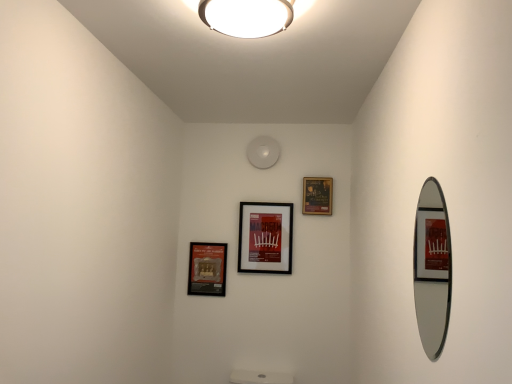
Question: Does white glossy ceiling light at upper center have a lesser width compared to matte black picture frame at center, placed as the second picture frame when sorted from right to left?

Choices:
 (A) no
 (B) yes

Answer: (A)

Question: Is white glossy ceiling light at upper center further to camera compared to matte black picture frame at center, the 2th picture frame viewed from the left?

Choices:
 (A) no
 (B) yes

Answer: (A)

Question: Is the position of white glossy ceiling light at upper center less distant than that of matte black picture frame at center, placed as the second picture frame when sorted from right to left?

Choices:
 (A) yes
 (B) no

Answer: (A)

Question: Does white glossy ceiling light at upper center have a lesser height compared to matte black picture frame at center, placed as the second picture frame when sorted from right to left?

Choices:
 (A) no
 (B) yes

Answer: (B)

Question: Is white glossy ceiling light at upper center turned away from matte black picture frame at center, placed as the second picture frame when sorted from right to left?

Choices:
 (A) no
 (B) yes

Answer: (A)

Question: From the image's perspective, relative to matte black picture frame at upper center, which ranks as the 3th picture frame in left-to-right order, is white glossy ceiling light at upper center above or below?

Choices:
 (A) below
 (B) above

Answer: (B)

Question: From a real-world perspective, is white glossy ceiling light at upper center above or below matte black picture frame at upper center, which ranks as the 3th picture frame in left-to-right order?

Choices:
 (A) above
 (B) below

Answer: (A)

Question: In terms of height, does white glossy ceiling light at upper center look taller or shorter compared to matte black picture frame at upper center, acting as the first picture frame starting from the right?

Choices:
 (A) short
 (B) tall

Answer: (A)

Question: Is white glossy ceiling light at upper center to the left or to the right of matte black picture frame at upper center, acting as the first picture frame starting from the right, in the image?

Choices:
 (A) right
 (B) left

Answer: (B)

Question: From the image's perspective, relative to matte black picture frame at lower left, placed as the third picture frame when sorted from right to left, is white glossy ceiling light at upper center above or below?

Choices:
 (A) below
 (B) above

Answer: (B)

Question: Considering the positions of white glossy ceiling light at upper center and matte black picture frame at lower left, placed as the third picture frame when sorted from right to left, in the image, is white glossy ceiling light at upper center bigger or smaller than matte black picture frame at lower left, placed as the third picture frame when sorted from right to left,?

Choices:
 (A) small
 (B) big

Answer: (B)

Question: From a real-world perspective, is white glossy ceiling light at upper center physically located above or below matte black picture frame at lower left, placed as the third picture frame when sorted from right to left?

Choices:
 (A) below
 (B) above

Answer: (B)

Question: Is point (246, 3) closer or farther from the camera than point (194, 249)?

Choices:
 (A) closer
 (B) farther

Answer: (A)

Question: Is point (249, 228) positioned closer to the camera than point (266, 14)?

Choices:
 (A) farther
 (B) closer

Answer: (A)

Question: From the image's perspective, is matte black picture frame at center, placed as the second picture frame when sorted from right to left, above or below white glossy ceiling light at upper center?

Choices:
 (A) above
 (B) below

Answer: (B)